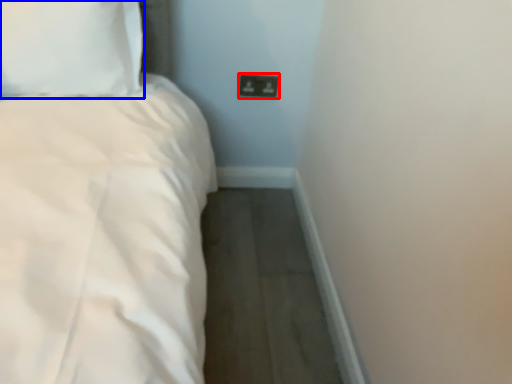
Question: Which object is closer to the camera taking this photo, socket (highlighted by a red box) or pillow (highlighted by a blue box)?

Choices:
 (A) socket
 (B) pillow

Answer: (B)